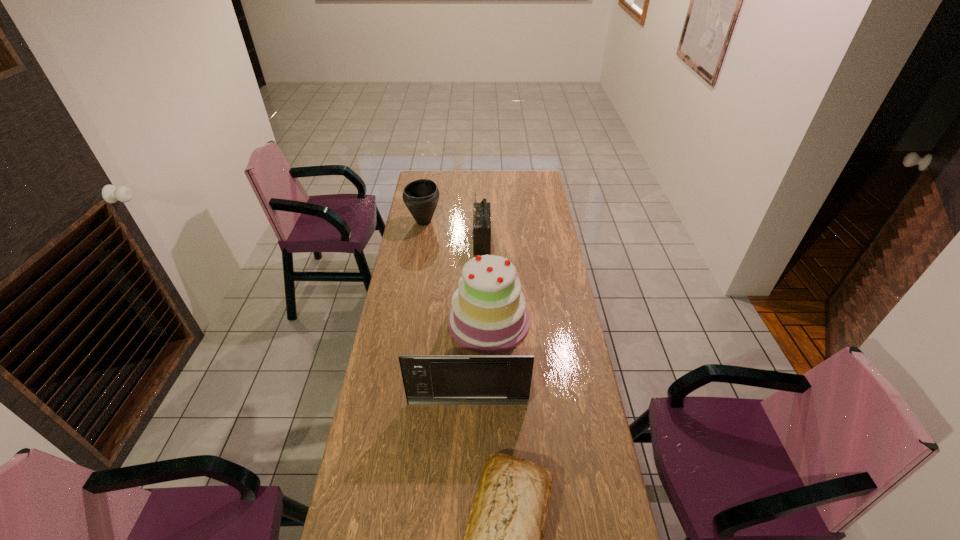
Identify the location of object that can be found as the second closest to the second nearest object. (488, 315).

Image resolution: width=960 pixels, height=540 pixels. I want to click on free space that satisfies the following two spatial constraints: 1. on the front panel of the radio receiver; 2. on the front panel of the fourth farthest object, so 482,402.

This screenshot has width=960, height=540. Find the location of `vacant space that satisfies the following two spatial constraints: 1. on the front panel of the radio receiver; 2. on the front panel of the microwave oven`. vacant space that satisfies the following two spatial constraints: 1. on the front panel of the radio receiver; 2. on the front panel of the microwave oven is located at coordinates (482, 402).

Identify the location of vacant region that satisfies the following two spatial constraints: 1. on the front side of the cake; 2. on the right side of the urn. This screenshot has width=960, height=540. (407, 321).

At what (x,y) coordinates should I click in order to perform the action: click on vacant area in the image that satisfies the following two spatial constraints: 1. on the front panel of the radio receiver; 2. on the back side of the cake. Please return your answer as a coordinate pair (x, y). Looking at the image, I should click on (482, 321).